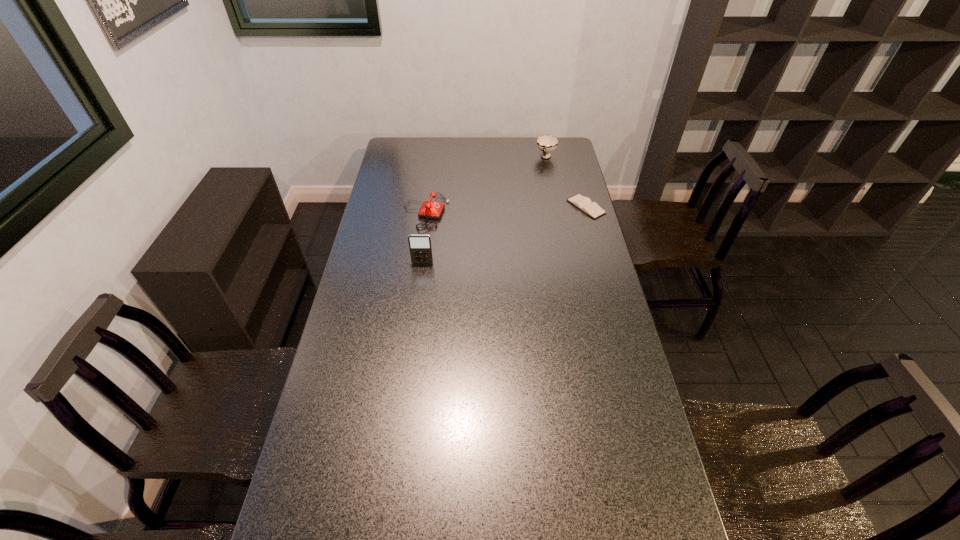
In order to click on the tallest object in this screenshot , I will do `click(420, 247)`.

This screenshot has width=960, height=540. In order to click on the nearest object in this screenshot , I will do (x=420, y=247).

This screenshot has height=540, width=960. Identify the location of diary. (583, 203).

Locate an element on the screen. This screenshot has width=960, height=540. the third tallest object is located at coordinates (430, 209).

This screenshot has width=960, height=540. I want to click on the second tallest object, so click(547, 143).

This screenshot has height=540, width=960. Identify the location of the farthest object. (547, 143).

The height and width of the screenshot is (540, 960). I want to click on free space located 0.210m on the front-facing side of the iPod, so click(x=417, y=306).

Identify the location of blank space located 0.290m on the left of the shortest object. (500, 207).

What are the coordinates of `free space located on the dial of the telephone` in the screenshot? It's located at (462, 218).

Find the location of a particular element. This screenshot has width=960, height=540. vacant point located on the dial of the telephone is located at coordinates (521, 225).